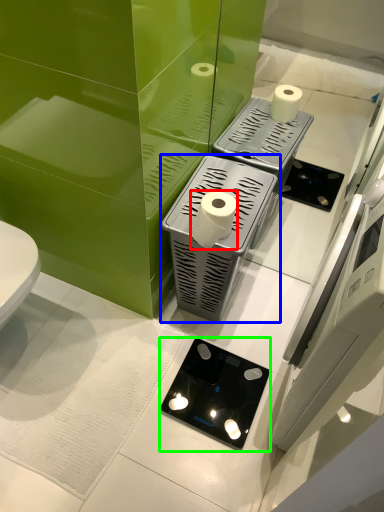
Question: Considering the real-world distances, which object is closest to toilet paper (highlighted by a red box)? appliance (highlighted by a blue box) or appliance (highlighted by a green box).

Choices:
 (A) appliance
 (B) appliance

Answer: (A)